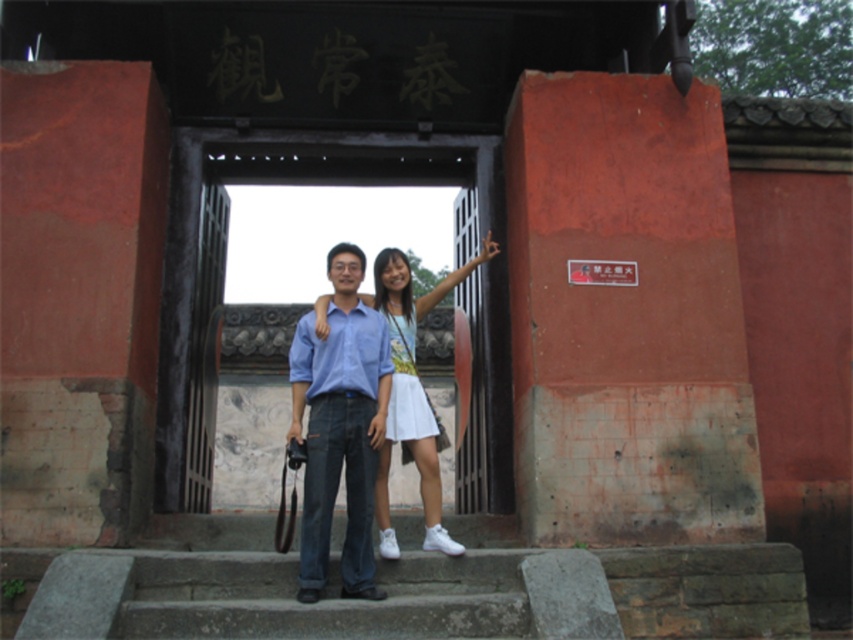
Question: Which object appears closest to the camera in this image?

Choices:
 (A) blue denim jeans at center
 (B) wooden gate at center
 (C) white cotton dress at center

Answer: (A)

Question: Does blue denim jeans at center appear under white cotton dress at center?

Choices:
 (A) yes
 (B) no

Answer: (A)

Question: Which point appears farthest from the camera in this image?

Choices:
 (A) (323, 568)
 (B) (408, 362)

Answer: (B)

Question: Does wooden gate at center have a smaller size compared to blue denim jeans at center?

Choices:
 (A) yes
 (B) no

Answer: (B)

Question: Which object is closer to the camera taking this photo?

Choices:
 (A) blue denim jeans at center
 (B) wooden gate at center
 (C) white cotton dress at center

Answer: (A)

Question: Can you confirm if wooden gate at center is smaller than white cotton dress at center?

Choices:
 (A) no
 (B) yes

Answer: (A)